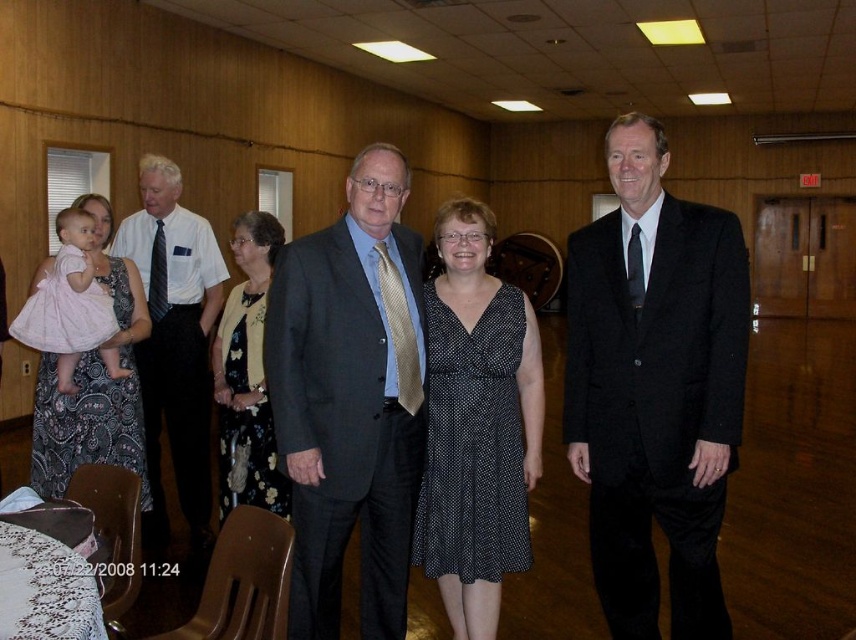
You are standing in the community hall and want to find the black wool suit at center. According to the coordinates given, where should you look?

The black wool suit at center is located at the coordinates point (654,387).

You are organizing a photo shoot and need to arrange the black wool suit at center and the pink satin dress at left in a line from left to right. Based on their current positions, which should come first?

The pink satin dress at left should come first in the leftmost position because the black wool suit at center is positioned on the right side of it.